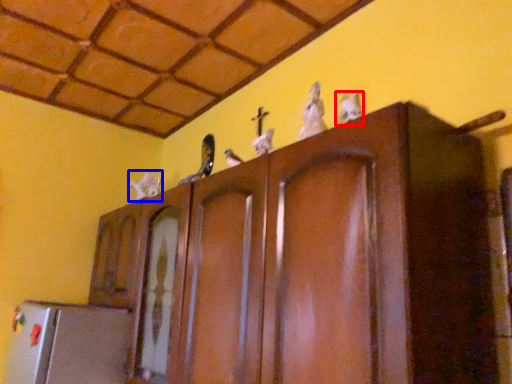
Question: Among these objects, which one is farthest to the camera, animal (highlighted by a red box) or animal (highlighted by a blue box)?

Choices:
 (A) animal
 (B) animal

Answer: (B)